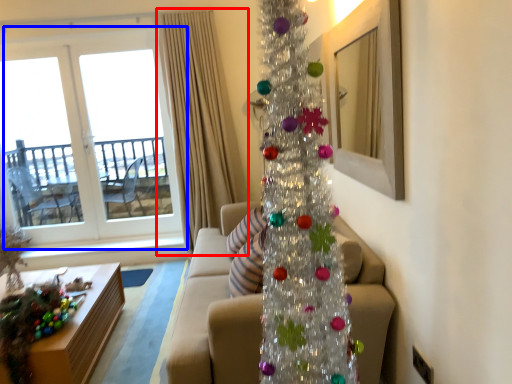
Question: Which of the following is the closest to the observer, curtain (highlighted by a red box) or window (highlighted by a blue box)?

Choices:
 (A) curtain
 (B) window

Answer: (A)